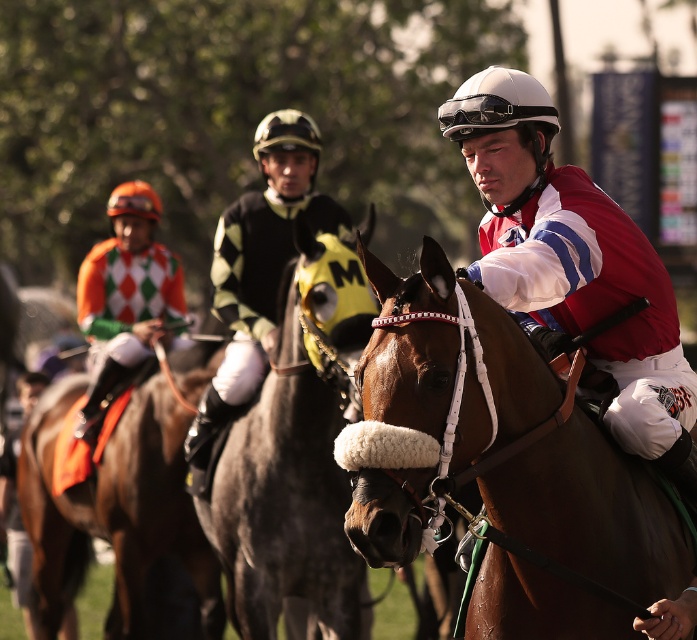
You are a photographer standing at the starting line of the horse race. You notice the matte black helmet at center and the orange and white checkered fabric at left. Which object is positioned higher in the image?

The matte black helmet at center is above the orange and white checkered fabric at left, so the matte black helmet at center is higher in the image.

You are a photographer at the horse race. You want to capture a photo that includes both the brown glossy saddle at left and the matte black helmet at center. Based on their sizes, which object should appear smaller in the photo?

The brown glossy saddle at left is shorter than the matte black helmet at center, so it should appear smaller in the photo.